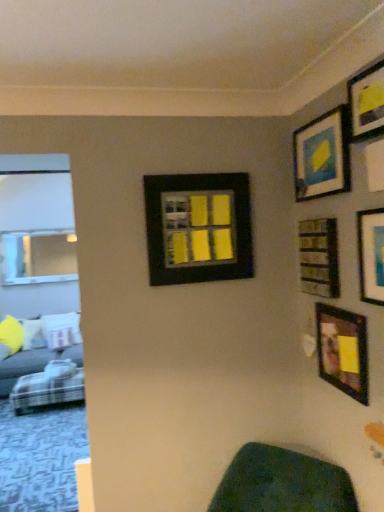
Question: Is wooden frame at lower right, the 4th picture frame when ordered from left to right, not near black matte picture frame at center, the 1th picture frame in the left-to-right sequence?

Choices:
 (A) yes
 (B) no

Answer: (B)

Question: Does wooden frame at lower right, the 3th picture frame viewed from the right, come behind black matte picture frame at center, which is counted as the sixth picture frame, starting from the right?

Choices:
 (A) yes
 (B) no

Answer: (B)

Question: Does wooden frame at lower right, the 3th picture frame viewed from the right, have a lesser width compared to black matte picture frame at center, the 1th picture frame in the left-to-right sequence?

Choices:
 (A) yes
 (B) no

Answer: (A)

Question: Is wooden frame at lower right, the 4th picture frame when ordered from left to right, looking in the opposite direction of black matte picture frame at center, which is counted as the sixth picture frame, starting from the right?

Choices:
 (A) yes
 (B) no

Answer: (B)

Question: Considering the relative sizes of wooden frame at lower right, the 4th picture frame when ordered from left to right, and black matte picture frame at center, which is counted as the sixth picture frame, starting from the right, in the image provided, is wooden frame at lower right, the 4th picture frame when ordered from left to right, shorter than black matte picture frame at center, which is counted as the sixth picture frame, starting from the right,?

Choices:
 (A) yes
 (B) no

Answer: (A)

Question: Is plaid fabric couch at lower left to the left or to the right of wooden frame at lower right, the 4th picture frame when ordered from left to right, in the image?

Choices:
 (A) right
 (B) left

Answer: (B)

Question: In terms of width, does plaid fabric couch at lower left look wider or thinner when compared to wooden frame at lower right, the 4th picture frame when ordered from left to right?

Choices:
 (A) thin
 (B) wide

Answer: (B)

Question: Would you say plaid fabric couch at lower left is inside or outside wooden frame at lower right, the 3th picture frame viewed from the right?

Choices:
 (A) inside
 (B) outside

Answer: (B)

Question: From a real-world perspective, relative to wooden frame at lower right, the 3th picture frame viewed from the right, is plaid fabric couch at lower left vertically above or below?

Choices:
 (A) above
 (B) below

Answer: (B)

Question: Is plush fabric couch at left inside the boundaries of plaid fabric couch at lower left, or outside?

Choices:
 (A) outside
 (B) inside

Answer: (A)

Question: From a real-world perspective, is plush fabric couch at left positioned above or below plaid fabric couch at lower left?

Choices:
 (A) below
 (B) above

Answer: (B)

Question: In the image, is plush fabric couch at left positioned in front of or behind plaid fabric couch at lower left?

Choices:
 (A) front
 (B) behind

Answer: (B)

Question: Considering the positions of plush fabric couch at left and plaid fabric couch at lower left in the image, is plush fabric couch at left taller or shorter than plaid fabric couch at lower left?

Choices:
 (A) tall
 (B) short

Answer: (A)

Question: Based on their positions, is wooden frame at lower right, the 3th picture frame viewed from the right, located to the left or right of plaid fabric couch at lower left?

Choices:
 (A) left
 (B) right

Answer: (B)

Question: In terms of size, does wooden frame at lower right, the 3th picture frame viewed from the right, appear bigger or smaller than plaid fabric couch at lower left?

Choices:
 (A) big
 (B) small

Answer: (B)